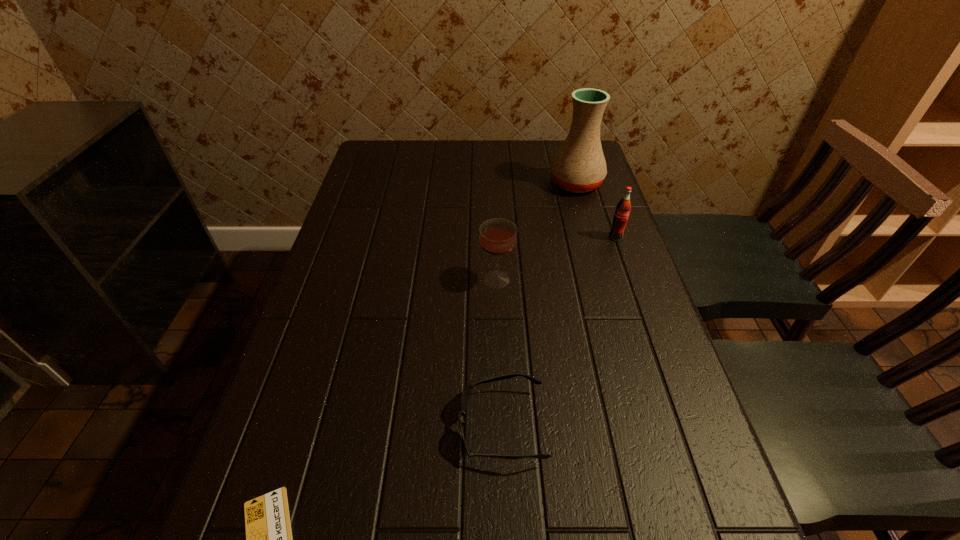
Identify the location of the tallest object. (579, 166).

This screenshot has width=960, height=540. Identify the location of the farthest object. (579, 166).

Locate an element on the screen. Image resolution: width=960 pixels, height=540 pixels. soda bottle is located at coordinates (623, 208).

This screenshot has width=960, height=540. Find the location of `the third nearest object`. the third nearest object is located at coordinates (498, 237).

Find the location of a particular element. The width and height of the screenshot is (960, 540). sunglasses is located at coordinates (464, 397).

Image resolution: width=960 pixels, height=540 pixels. What are the coordinates of `the second nearest object` in the screenshot? It's located at (464, 397).

At what (x,y) coordinates should I click in order to perform the action: click on free region located on the left of the pottery. Please return your answer as a coordinate pair (x, y). Looking at the image, I should click on (427, 184).

Where is `vacant point located on the label of the soda bottle`? The image size is (960, 540). vacant point located on the label of the soda bottle is located at coordinates (637, 299).

Where is `vacant space situated on the front of the wineglass`? Image resolution: width=960 pixels, height=540 pixels. vacant space situated on the front of the wineglass is located at coordinates (503, 449).

Locate an element on the screen. Image resolution: width=960 pixels, height=540 pixels. free space located on the lenses of the fourth tallest object is located at coordinates (420, 426).